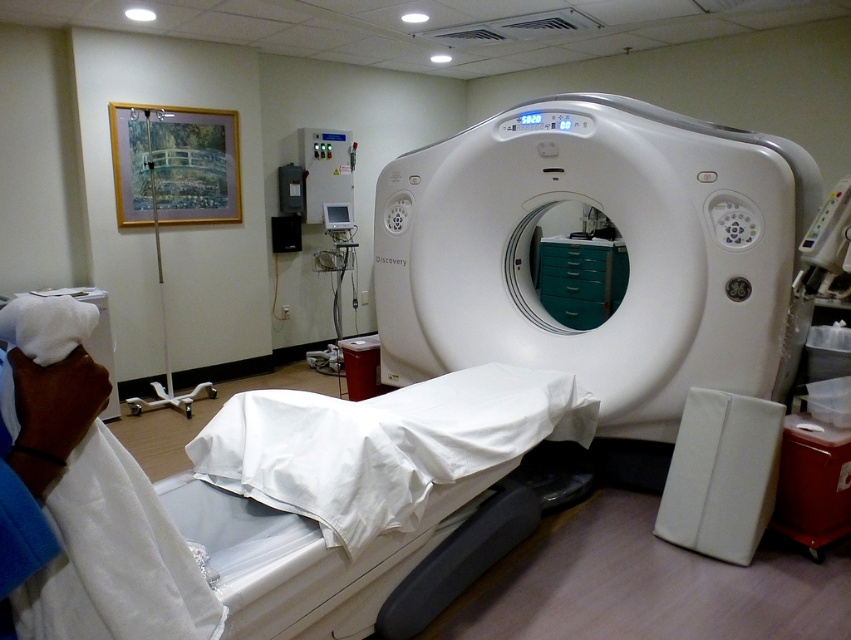
Can you confirm if white glossy ct scanner at center is wider than white plastic pole at left?

Yes.

Can you confirm if white glossy ct scanner at center is smaller than white plastic pole at left?

No, white glossy ct scanner at center is not smaller than white plastic pole at left.

Is point (403, 216) positioned before point (164, 371)?

That is True.

Where is `white glossy ct scanner at center`? white glossy ct scanner at center is located at coordinates (618, 237).